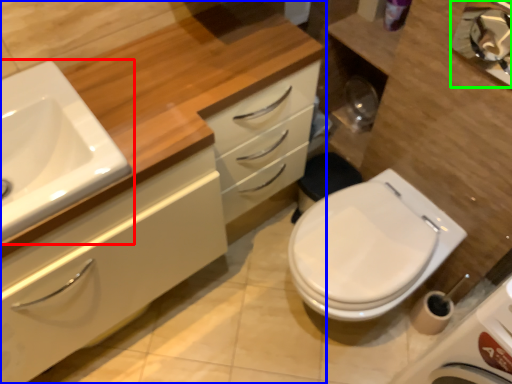
Question: Based on their relative distances, which object is nearer to sink (highlighted by a red box)? Choose from bathroom cabinet (highlighted by a blue box) and mirror (highlighted by a green box).

Choices:
 (A) bathroom cabinet
 (B) mirror

Answer: (A)